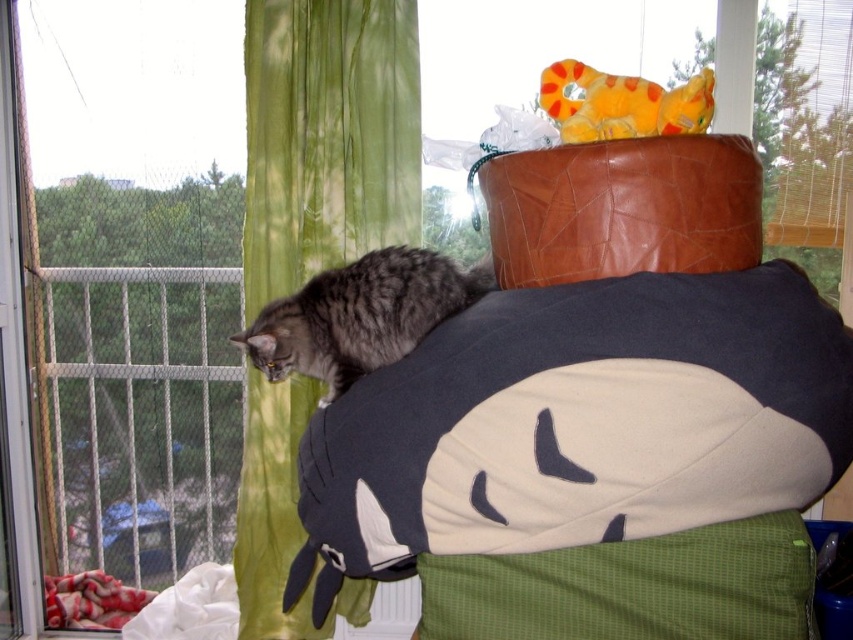
Question: Does metal mesh window at left appear over soft plush toy at upper right?

Choices:
 (A) yes
 (B) no

Answer: (B)

Question: Among these points, which one is farthest from the camera?

Choices:
 (A) (323, 163)
 (B) (607, 328)
 (C) (189, 252)

Answer: (C)

Question: Among these points, which one is farthest from the camera?

Choices:
 (A) (32, 413)
 (B) (244, 435)
 (C) (602, 138)
 (D) (637, 280)

Answer: (A)

Question: Does dark gray plush pillow at upper center appear on the right side of soft plush toy at upper right?

Choices:
 (A) no
 (B) yes

Answer: (A)

Question: Can you confirm if metal mesh window at left is positioned below green sheer curtain at upper left?

Choices:
 (A) yes
 (B) no

Answer: (B)

Question: Which point is closer to the camera?

Choices:
 (A) (705, 432)
 (B) (285, 170)
 (C) (604, 106)
 (D) (283, 374)

Answer: (A)